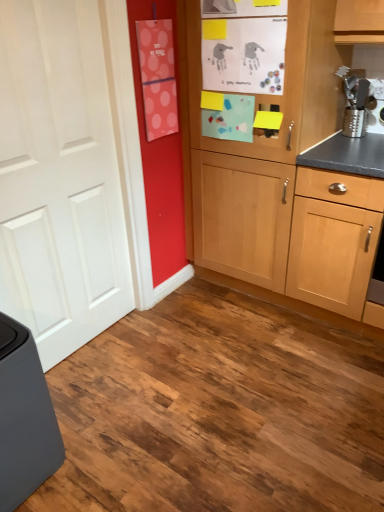
Identify the location of free space between white matte door at left and matte gray trash can at lower left. This screenshot has height=512, width=384. (x=94, y=384).